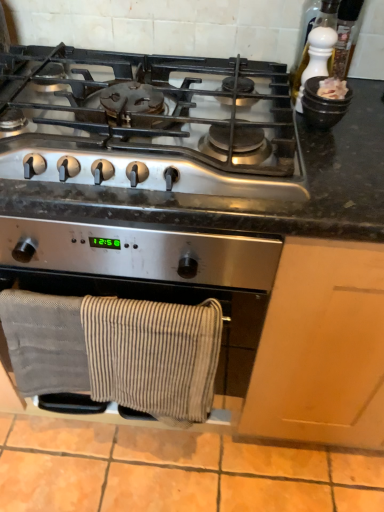
The height and width of the screenshot is (512, 384). Find the location of `free space in front of white ceramic pepper grinder at upper right`. free space in front of white ceramic pepper grinder at upper right is located at coordinates (336, 150).